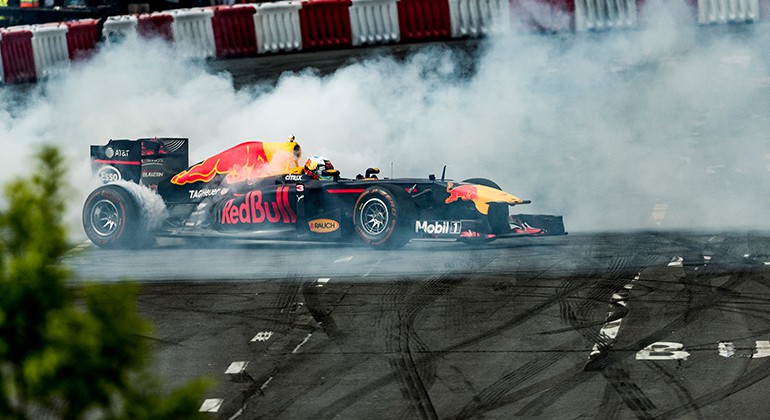
Locate an element on the screen. Image resolution: width=770 pixels, height=420 pixels. red wall is located at coordinates coord(9,53), coord(77,44), coord(163,17), coord(236,29), coord(320,27), coord(437,27).